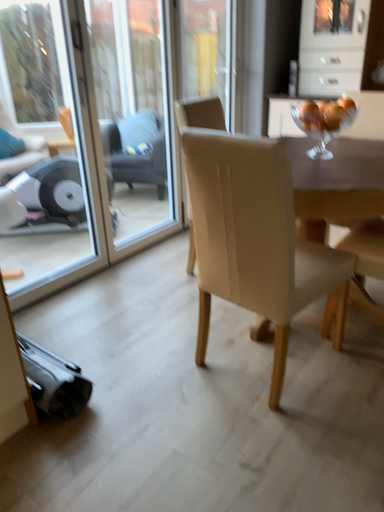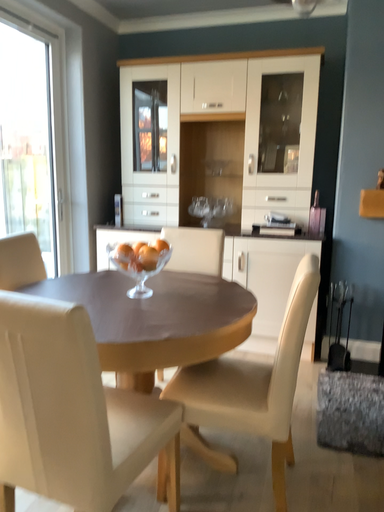
Question: How did the camera likely rotate when shooting the video?

Choices:
 (A) rotated downward
 (B) rotated upward

Answer: (B)